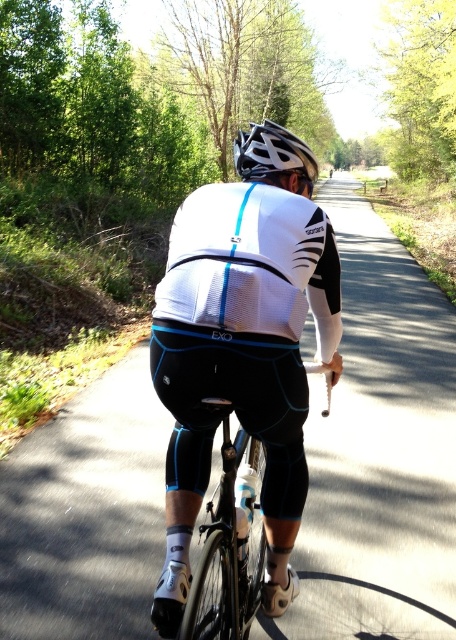
Question: Is the position of black matte bicycle at center more distant than that of white matte bicycle helmet at center?

Choices:
 (A) yes
 (B) no

Answer: (B)

Question: Can you confirm if white matte cycling jersey at center is positioned above black matte bicycle at center?

Choices:
 (A) no
 (B) yes

Answer: (B)

Question: Which point is farther to the camera?

Choices:
 (A) (207, 435)
 (B) (278, 131)
 (C) (198, 611)

Answer: (B)

Question: Can you confirm if white matte cycling jersey at center is positioned to the right of black matte bicycle at center?

Choices:
 (A) no
 (B) yes

Answer: (B)

Question: Which point is farther from the camera taking this photo?

Choices:
 (A) (210, 468)
 (B) (267, 154)

Answer: (B)

Question: Estimate the real-world distances between objects in this image. Which object is closer to the black matte bicycle at center?

Choices:
 (A) white matte cycling jersey at center
 (B) white matte bicycle helmet at center

Answer: (A)